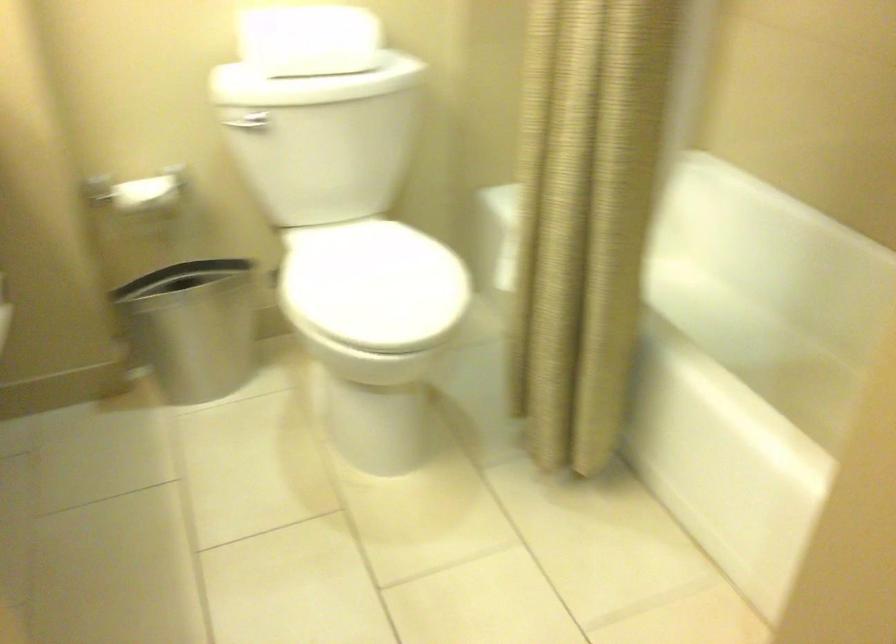
Identify the location of white toilet lid. The height and width of the screenshot is (644, 896). (372, 285).